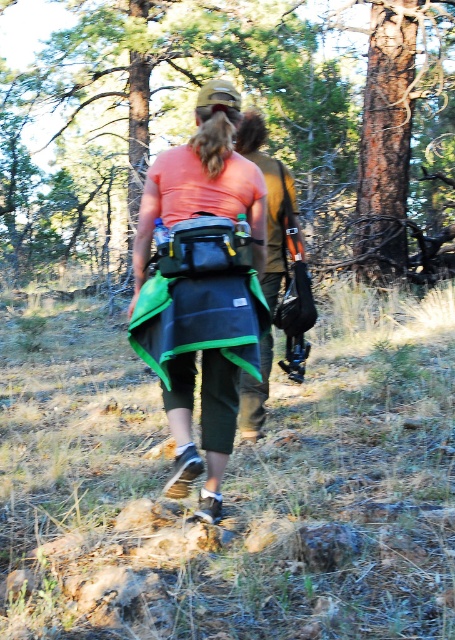
Question: Which point is closer to the camera taking this photo?

Choices:
 (A) (279, 264)
 (B) (150, 362)

Answer: (B)

Question: Is matte green backpack at center smaller than brown leather jacket at center?

Choices:
 (A) no
 (B) yes

Answer: (B)

Question: Among these points, which one is nearest to the camera?

Choices:
 (A) (212, 284)
 (B) (276, 240)

Answer: (A)

Question: Is matte green backpack at center wider than brown leather jacket at center?

Choices:
 (A) yes
 (B) no

Answer: (A)

Question: Which point is farther from the camera taking this photo?

Choices:
 (A) (141, 268)
 (B) (262, 349)

Answer: (B)

Question: Does matte green backpack at center come behind brown leather jacket at center?

Choices:
 (A) no
 (B) yes

Answer: (A)